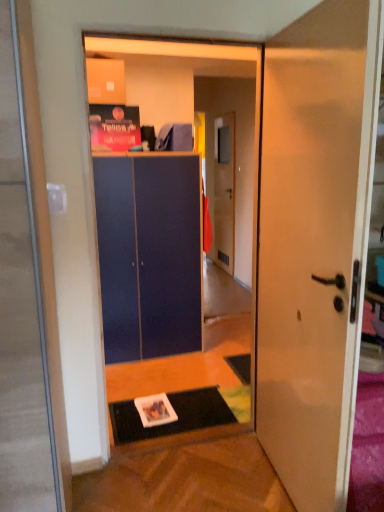
Question: Is black rubber doormat at lower center to the left or to the right of matte blue cabinet at center in the image?

Choices:
 (A) left
 (B) right

Answer: (B)

Question: From the image's perspective, is black rubber doormat at lower center above or below matte blue cabinet at center?

Choices:
 (A) below
 (B) above

Answer: (A)

Question: Which of these objects is positioned farthest from the wooden door at center, which appears as the 1th door when viewed from the back?

Choices:
 (A) black rubber doormat at lower center
 (B) matte blue cabinet at center
 (C) blue matte cabinet at center
 (D) white glossy door at center, the first door from the front

Answer: (D)

Question: Which of these objects is positioned closest to the white glossy door at center, the first door from the front?

Choices:
 (A) matte blue cabinet at center
 (B) black rubber doormat at lower center
 (C) wooden door at center, which is counted as the 2th door, starting from the front
 (D) blue matte cabinet at center

Answer: (D)